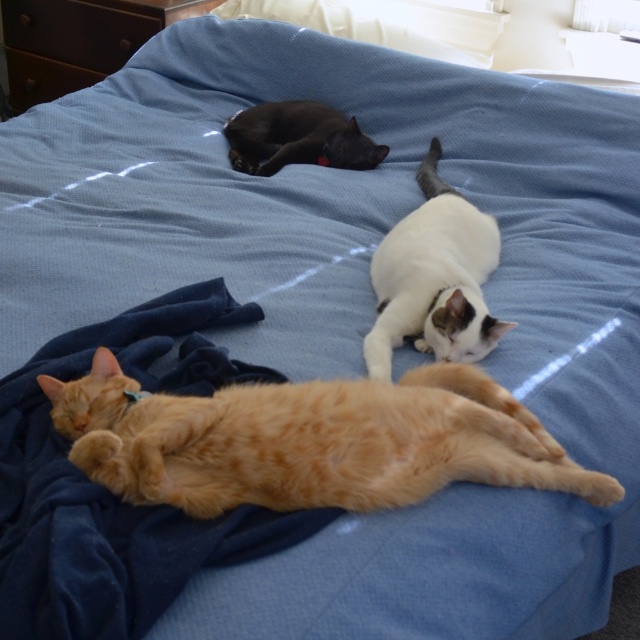
Question: Among these objects, which one is farthest from the camera?

Choices:
 (A) orange fur cat at lower left
 (B) white fur cat at center
 (C) brown wood dresser at upper left
 (D) velvety blue blanket at lower left

Answer: (C)

Question: Is orange fur cat at lower left to the left of brown wood dresser at upper left from the viewer's perspective?

Choices:
 (A) no
 (B) yes

Answer: (A)

Question: Which point is closer to the camera?

Choices:
 (A) white fur cat at center
 (B) orange fur cat at lower left
 (C) brown wood dresser at upper left

Answer: (B)

Question: Which object is the farthest from the orange fur cat at lower left?

Choices:
 (A) white fur cat at center
 (B) velvety blue blanket at lower left
 (C) shiny black cat at center
 (D) brown wood dresser at upper left

Answer: (D)

Question: Does white fur cat at center have a lesser width compared to shiny black cat at center?

Choices:
 (A) no
 (B) yes

Answer: (B)

Question: Can you confirm if velvety blue blanket at lower left is positioned to the right of brown wood dresser at upper left?

Choices:
 (A) no
 (B) yes

Answer: (B)